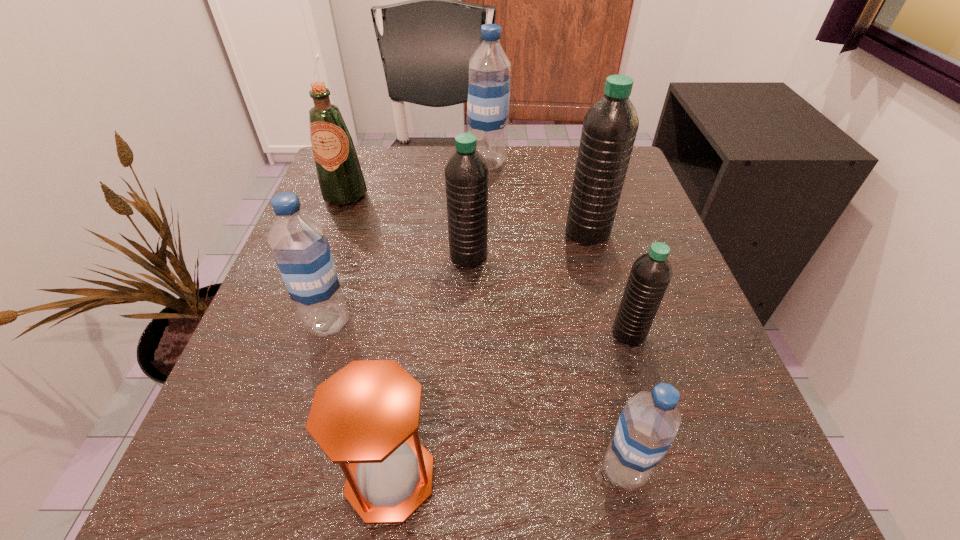
Find the location of `free point that satisfies the following two spatial constraints: 1. on the front-facing side of the green olive oil; 2. on the left side of the biggest black water bottle`. free point that satisfies the following two spatial constraints: 1. on the front-facing side of the green olive oil; 2. on the left side of the biggest black water bottle is located at coordinates (331, 233).

Identify the location of vacant space that satisfies the following two spatial constraints: 1. on the label of the nearest black water bottle; 2. on the left side of the leftmost water bottle. This screenshot has height=540, width=960. (324, 334).

Where is `vacant space that satisfies the following two spatial constraints: 1. on the front-facing side of the green olive oil; 2. on the right side of the leftmost black water bottle`? Image resolution: width=960 pixels, height=540 pixels. vacant space that satisfies the following two spatial constraints: 1. on the front-facing side of the green olive oil; 2. on the right side of the leftmost black water bottle is located at coordinates (322, 256).